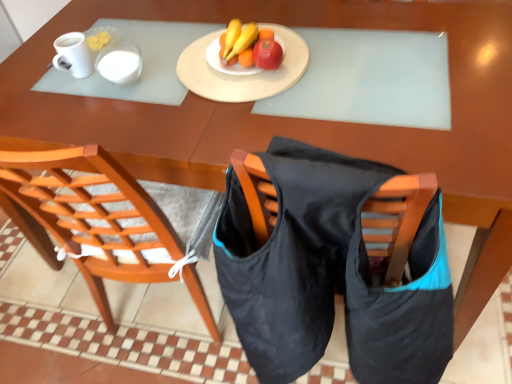
This screenshot has width=512, height=384. Identify the location of empty space that is to the right of matte white plate at center. (368, 55).